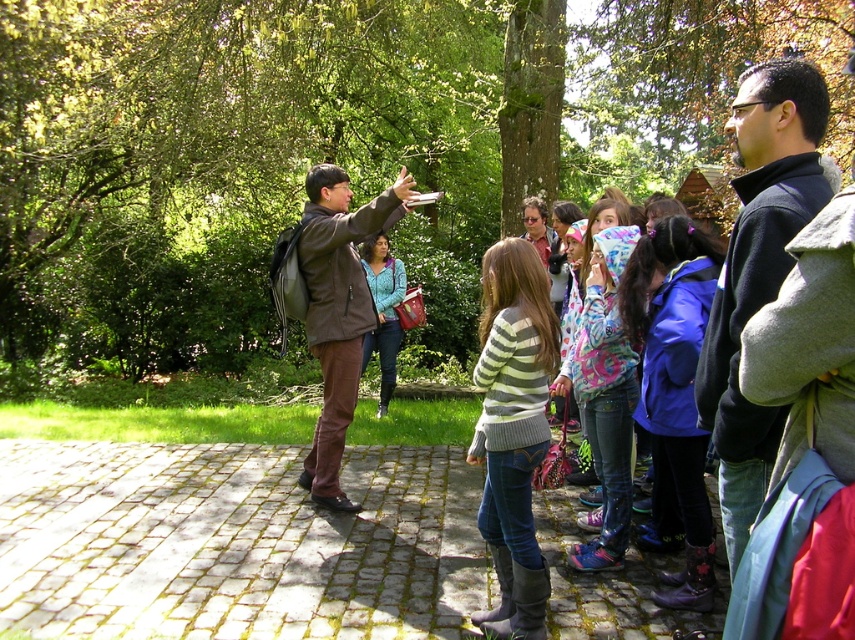
Question: Is green leafy tree at center to the left of brown leather jacket at center from the viewer's perspective?

Choices:
 (A) no
 (B) yes

Answer: (A)

Question: Which point is closer to the camera?

Choices:
 (A) (316, 284)
 (B) (376, 332)
 (C) (174, 148)
 (D) (824, 106)

Answer: (D)

Question: Considering the relative positions of green leafy tree at center and matte blue sweater at center in the image provided, where is green leafy tree at center located with respect to matte blue sweater at center?

Choices:
 (A) left
 (B) right

Answer: (B)

Question: Which is nearer to the striped sweater at center?

Choices:
 (A) dark blue fleece jacket at center
 (B) green leafy tree at center
 (C) brown leather jacket at center
 (D) matte blue sweater at center

Answer: (A)

Question: Where is dark blue fleece jacket at center located in relation to striped sweater at center in the image?

Choices:
 (A) above
 (B) below

Answer: (A)

Question: Among these objects, which one is farthest from the camera?

Choices:
 (A) dark blue fleece jacket at center
 (B) green leafy tree at center
 (C) matte blue sweater at center
 (D) striped sweater at center

Answer: (C)